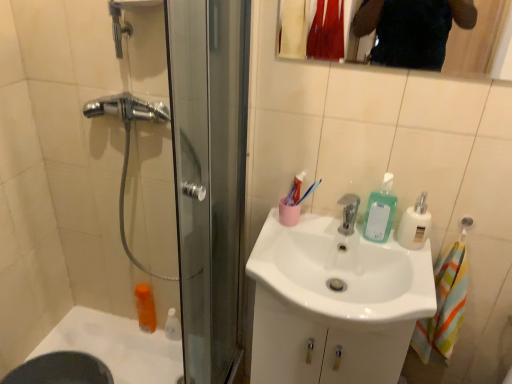
Question: Would you say orange plastic mouthwash at lower left is part of white plastic soap dispenser at upper right, which ranks as the 2th soap dispenser in left-to-right order,'s contents?

Choices:
 (A) no
 (B) yes

Answer: (A)

Question: Is white plastic soap dispenser at upper right, which ranks as the 2th soap dispenser in left-to-right order, smaller than orange plastic mouthwash at lower left?

Choices:
 (A) no
 (B) yes

Answer: (B)

Question: Is white plastic soap dispenser at upper right, placed as the first soap dispenser when sorted from right to left, directly adjacent to orange plastic mouthwash at lower left?

Choices:
 (A) yes
 (B) no

Answer: (B)

Question: Does white plastic soap dispenser at upper right, placed as the first soap dispenser when sorted from right to left, have a lesser height compared to orange plastic mouthwash at lower left?

Choices:
 (A) no
 (B) yes

Answer: (B)

Question: Is white plastic soap dispenser at upper right, which ranks as the 2th soap dispenser in left-to-right order, thinner than orange plastic mouthwash at lower left?

Choices:
 (A) yes
 (B) no

Answer: (A)

Question: Is orange plastic mouthwash at lower left at the back of white plastic soap dispenser at upper right, which ranks as the 2th soap dispenser in left-to-right order?

Choices:
 (A) yes
 (B) no

Answer: (B)

Question: Is white glossy bottle at lower left positioned with its back to white plastic soap dispenser at upper right, placed as the first soap dispenser when sorted from right to left?

Choices:
 (A) yes
 (B) no

Answer: (B)

Question: From a real-world perspective, is white glossy bottle at lower left on white plastic soap dispenser at upper right, placed as the first soap dispenser when sorted from right to left?

Choices:
 (A) yes
 (B) no

Answer: (B)

Question: Is white glossy bottle at lower left wider than white plastic soap dispenser at upper right, which ranks as the 2th soap dispenser in left-to-right order?

Choices:
 (A) yes
 (B) no

Answer: (B)

Question: Considering the relative positions of white glossy bottle at lower left and white plastic soap dispenser at upper right, which ranks as the 2th soap dispenser in left-to-right order, in the image provided, is white glossy bottle at lower left to the right of white plastic soap dispenser at upper right, which ranks as the 2th soap dispenser in left-to-right order, from the viewer's perspective?

Choices:
 (A) no
 (B) yes

Answer: (A)

Question: Can you see white glossy bottle at lower left touching white plastic soap dispenser at upper right, placed as the first soap dispenser when sorted from right to left?

Choices:
 (A) no
 (B) yes

Answer: (A)

Question: Can you confirm if white glossy bottle at lower left is smaller than white plastic soap dispenser at upper right, which ranks as the 2th soap dispenser in left-to-right order?

Choices:
 (A) no
 (B) yes

Answer: (B)

Question: Can you confirm if white plastic soap dispenser at upper right, which ranks as the 2th soap dispenser in left-to-right order, is wider than white glossy bottle at lower left?

Choices:
 (A) yes
 (B) no

Answer: (A)